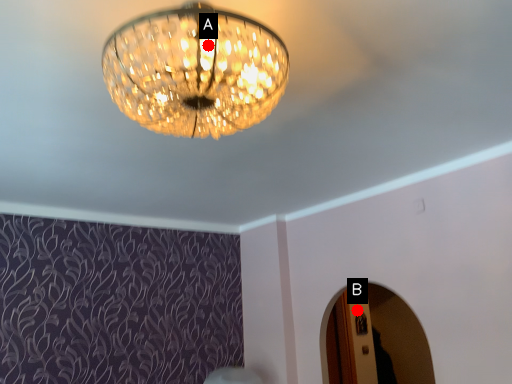
Question: Two points are circled on the image, labeled by A and B beside each circle. Among these points, which one is farthest from the camera?

Choices:
 (A) A is further
 (B) B is further

Answer: (B)